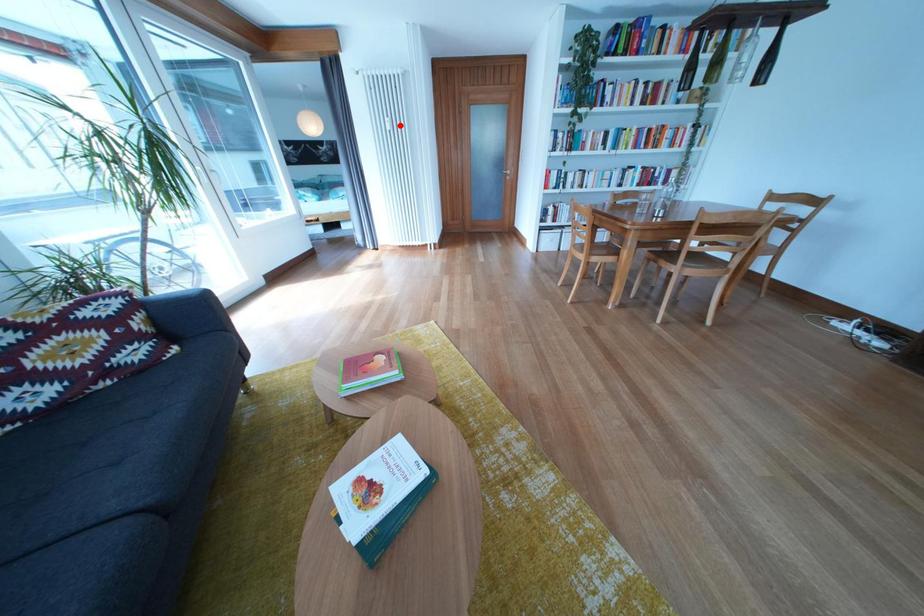
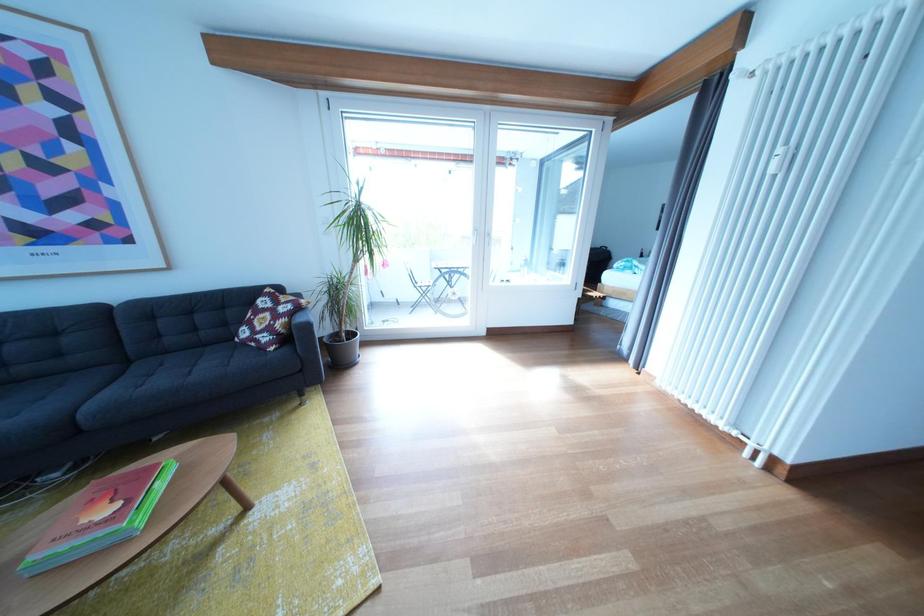
Question: I am providing you with two images of the same scene from different viewpoints. Image1 has a red point marked. In image2, the corresponding 3D location appears at what relative position? Reply with the corresponding letter.

Choices:
 (A) Closer
 (B) Farther

Answer: (B)